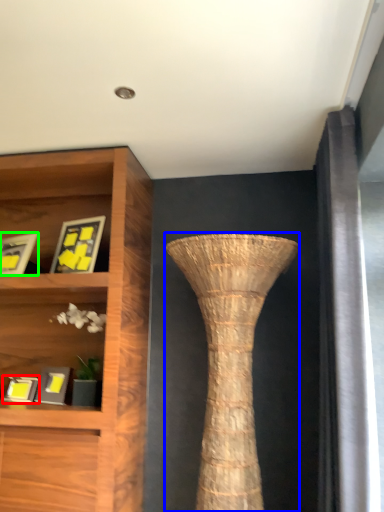
Question: Which is nearer to the picture frame (highlighted by a red box)? vase (highlighted by a blue box) or picture frame (highlighted by a green box).

Choices:
 (A) vase
 (B) picture frame

Answer: (B)